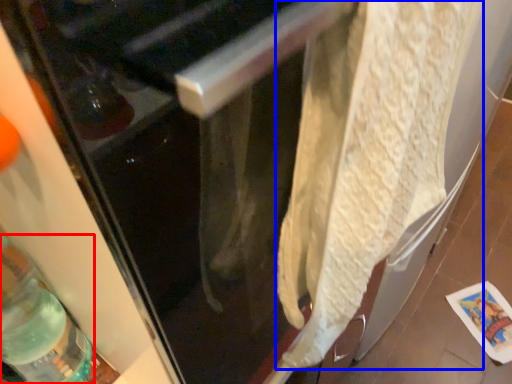
Question: Which of the following is the closest to the observer, bottle (highlighted by a red box) or wrap (highlighted by a blue box)?

Choices:
 (A) bottle
 (B) wrap

Answer: (B)